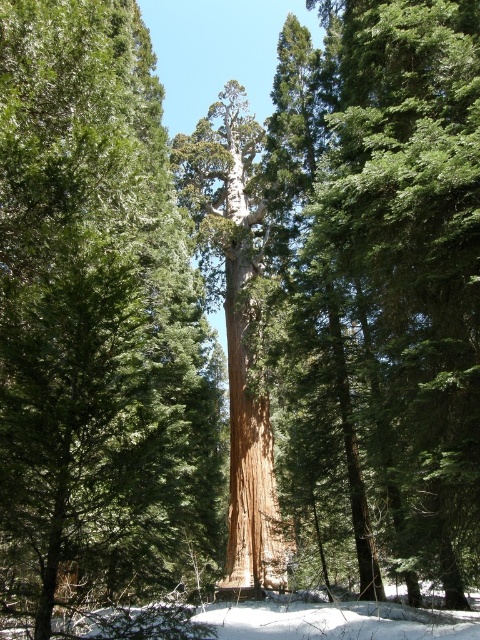
Question: Does smooth brown tree trunk at center have a greater width compared to rough bark tree at center?

Choices:
 (A) no
 (B) yes

Answer: (A)

Question: Does smooth brown trunk at center appear on the right side of smooth brown tree trunk at center?

Choices:
 (A) yes
 (B) no

Answer: (B)

Question: Which of these objects is positioned farthest from the rough bark tree at center?

Choices:
 (A) smooth brown trunk at center
 (B) smooth brown tree trunk at center

Answer: (B)

Question: Which is farther from the rough bark tree at center?

Choices:
 (A) smooth brown trunk at center
 (B) smooth brown tree trunk at center

Answer: (B)

Question: Does smooth brown tree trunk at center appear on the right side of rough bark tree at center?

Choices:
 (A) yes
 (B) no

Answer: (A)

Question: Which point is farther to the camera?

Choices:
 (A) (231, 428)
 (B) (73, 36)

Answer: (A)